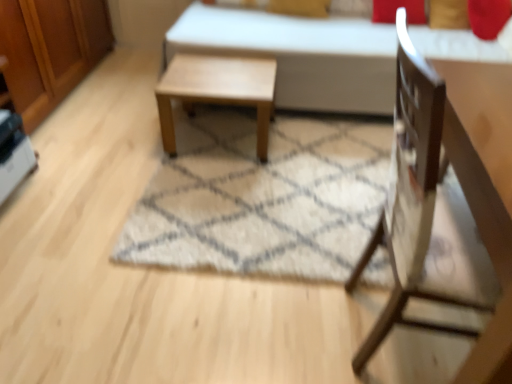
Question: In terms of height, does wooden dresser at left look taller or shorter compared to white fabric bed at center?

Choices:
 (A) short
 (B) tall

Answer: (A)

Question: In terms of width, does wooden dresser at left look wider or thinner when compared to white fabric bed at center?

Choices:
 (A) thin
 (B) wide

Answer: (A)

Question: Based on their relative distances, which object is farther from the wooden dresser at left?

Choices:
 (A) light brown wooden table at center
 (B) wooden chair at right
 (C) white fabric bed at center
 (D) white shaggy rug at center

Answer: (B)

Question: Which of these objects is positioned farthest from the white shaggy rug at center?

Choices:
 (A) light brown wooden table at center
 (B) wooden chair at right
 (C) wooden dresser at left
 (D) white fabric bed at center

Answer: (C)